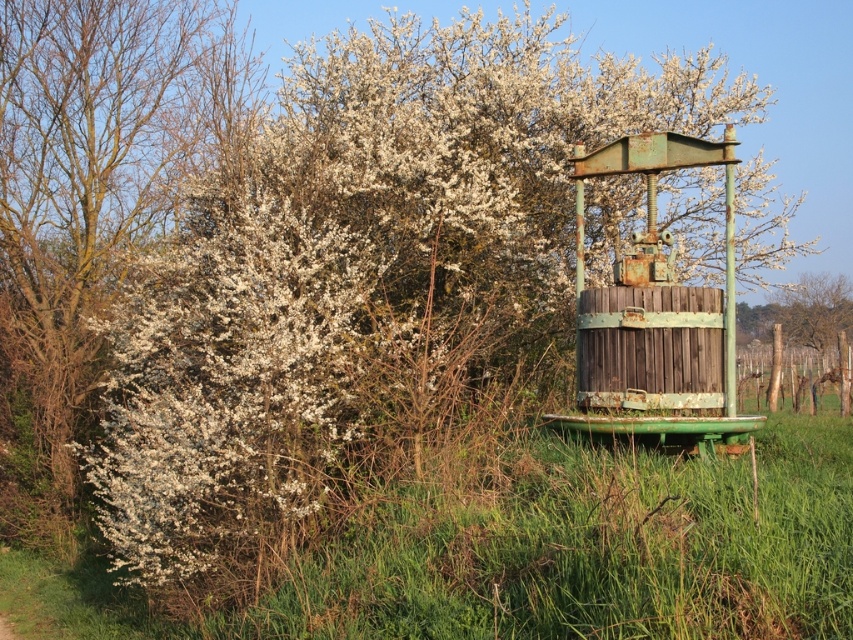
Find the location of a particular element. The width and height of the screenshot is (853, 640). green grass at right is located at coordinates click(537, 554).

Is point (573, 609) in front of point (13, 225)?

Yes, point (573, 609) is in front of point (13, 225).

Identify the location of green grass at right. (537, 554).